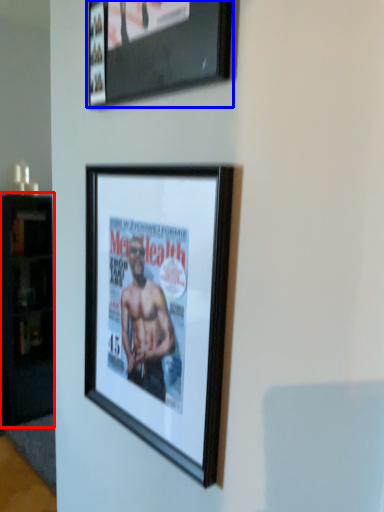
Question: Which object is closer to the camera taking this photo, cabinetry (highlighted by a red box) or picture frame (highlighted by a blue box)?

Choices:
 (A) cabinetry
 (B) picture frame

Answer: (B)